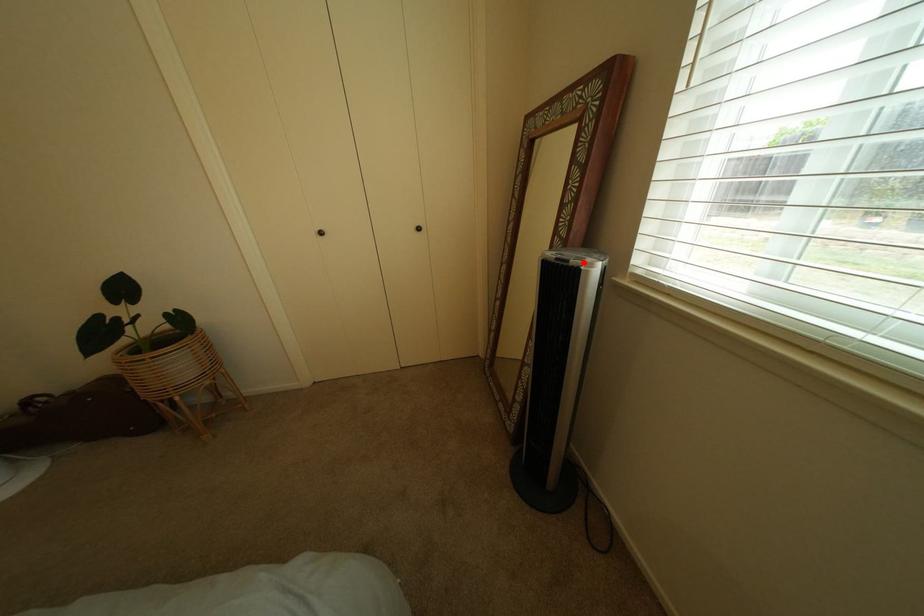
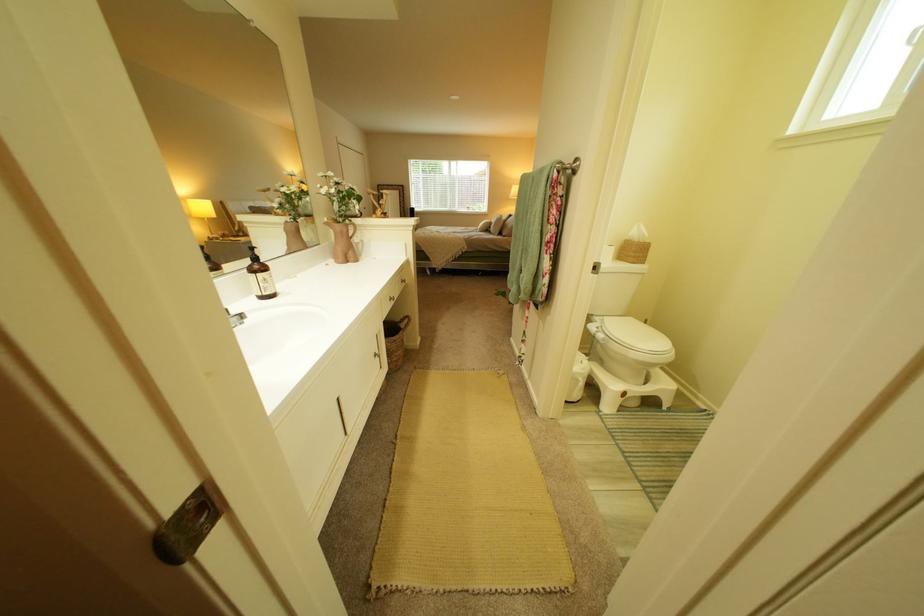
Question: I am providing you with two images of the same scene from different viewpoints. A red point is marked on the first image. At the location where the point appears in image 1, is it still visible in image 2?

Choices:
 (A) Yes
 (B) No

Answer: (B)